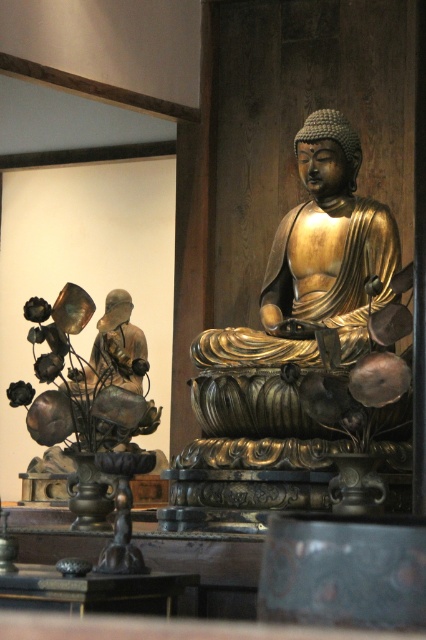
Question: Which point is farther to the camera?

Choices:
 (A) (103, 336)
 (B) (37, 602)

Answer: (A)

Question: Is gold polished bronze buddha at center further to camera compared to black polished wood table at center?

Choices:
 (A) no
 (B) yes

Answer: (B)

Question: Considering the relative positions of gold polished bronze buddha at center and matte black statue at left in the image provided, where is gold polished bronze buddha at center located with respect to matte black statue at left?

Choices:
 (A) below
 (B) above

Answer: (B)

Question: Is matte black statue at left thinner than black polished wood table at center?

Choices:
 (A) yes
 (B) no

Answer: (B)

Question: Which object is the closest to the matte black statue at left?

Choices:
 (A) black polished wood table at center
 (B) gold polished bronze buddha at center

Answer: (B)

Question: Estimate the real-world distances between objects in this image. Which object is farther from the gold polished bronze buddha at center?

Choices:
 (A) black polished wood table at center
 (B) matte black statue at left

Answer: (A)